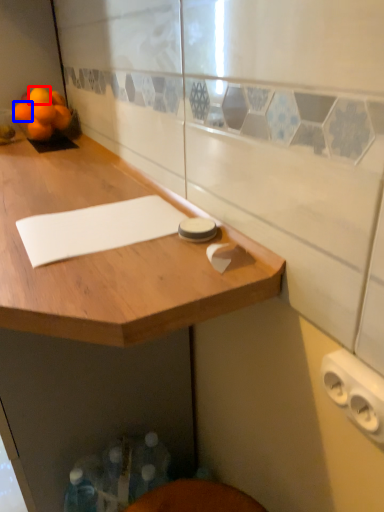
Question: Which object is further to the camera taking this photo, orange (highlighted by a red box) or orange (highlighted by a blue box)?

Choices:
 (A) orange
 (B) orange

Answer: (A)